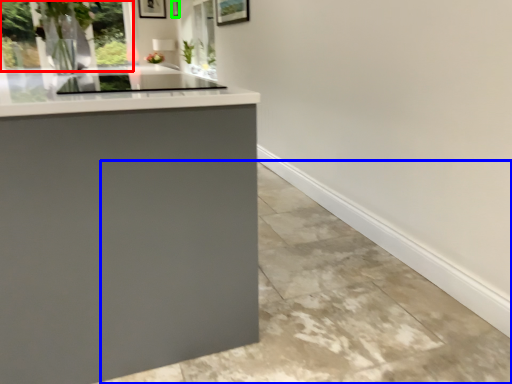
Question: Estimate the real-world distances between objects in this image. Which object is farther from window (highlighted by a red box), concrete (highlighted by a blue box) or picture frame (highlighted by a green box)?

Choices:
 (A) concrete
 (B) picture frame

Answer: (B)